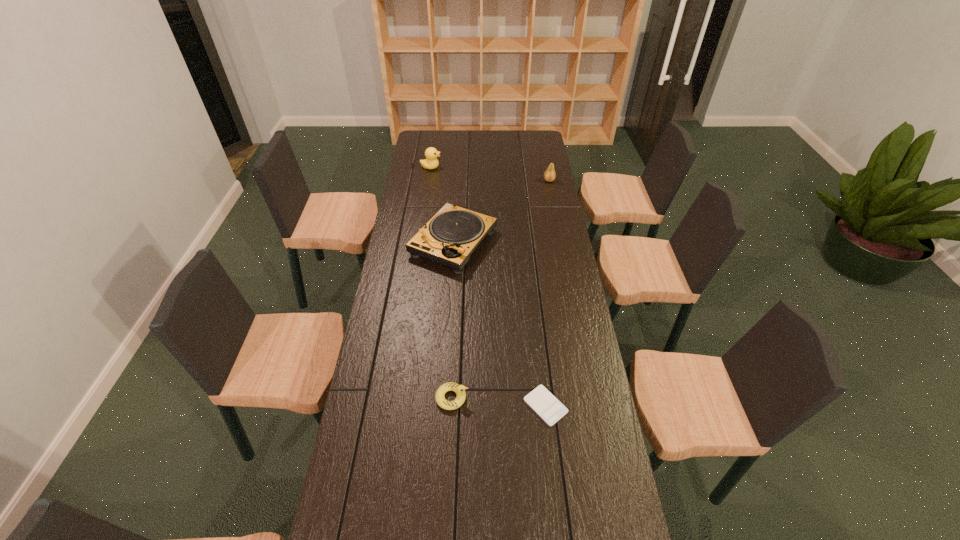
At what (x,y) coordinates should I click in order to perform the action: click on the farthest object. Please return your answer as a coordinate pair (x, y). Image resolution: width=960 pixels, height=540 pixels. Looking at the image, I should click on coord(431,154).

Find the location of a particular element. the rightmost object is located at coordinates (549, 175).

This screenshot has height=540, width=960. I want to click on pear, so click(x=549, y=175).

The width and height of the screenshot is (960, 540). I want to click on record player, so click(x=449, y=238).

Where is `the fourth tallest object`? This screenshot has height=540, width=960. the fourth tallest object is located at coordinates (459, 389).

The image size is (960, 540). I want to click on calculator, so click(x=546, y=405).

You are a GUI agent. You are given a task and a screenshot of the screen. Output one action in this format:
    pyautogui.click(x=<x>, y=<y>)
    Task: Click on the shortest object
    
    Given the screenshot: What is the action you would take?
    pyautogui.click(x=546, y=405)

The height and width of the screenshot is (540, 960). I want to click on blank area located on the face of the duck, so click(x=517, y=167).

The image size is (960, 540). Identify the location of free space located on the back of the pear. (544, 154).

The height and width of the screenshot is (540, 960). What are the coordinates of `free spot located 0.070m on the front of the third nearest object` in the screenshot? It's located at (450, 289).